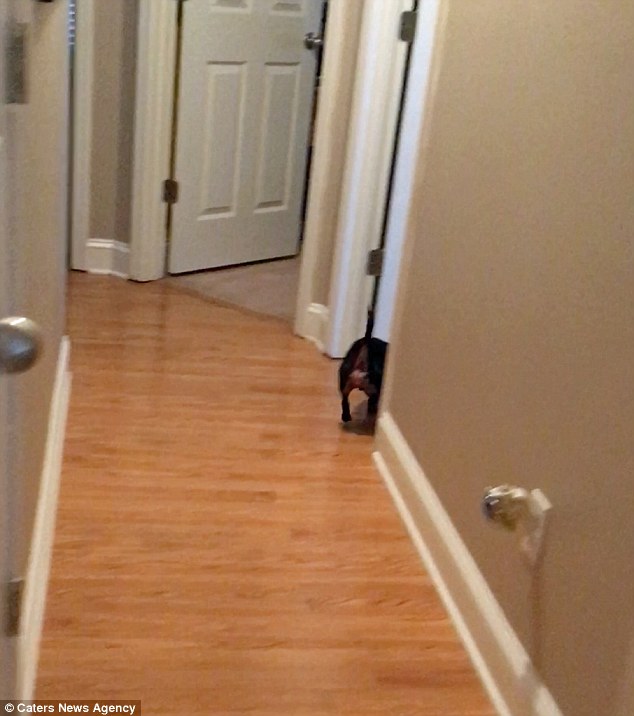
Locate an element on the screen. This screenshot has height=716, width=634. air freshner is located at coordinates (510, 500).